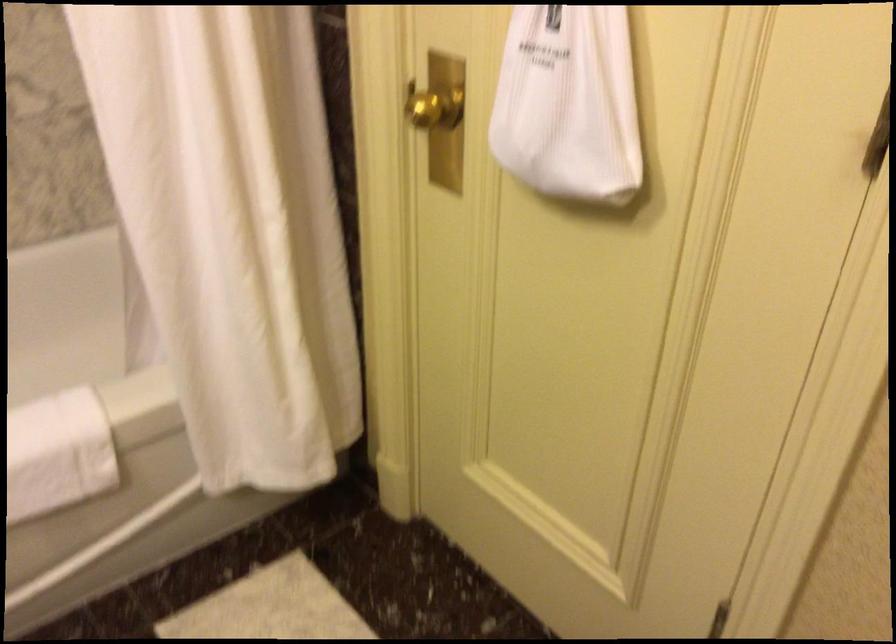
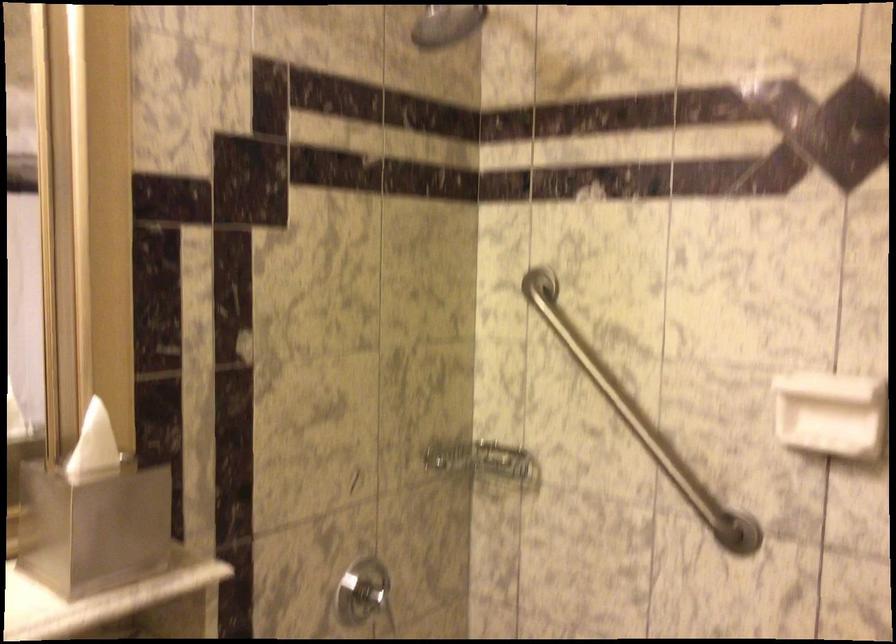
Question: The first image is from the beginning of the video and the second image is from the end. How did the camera likely rotate when shooting the video?

Choices:
 (A) Left
 (B) Right
 (C) Up
 (D) Down

Answer: (A)